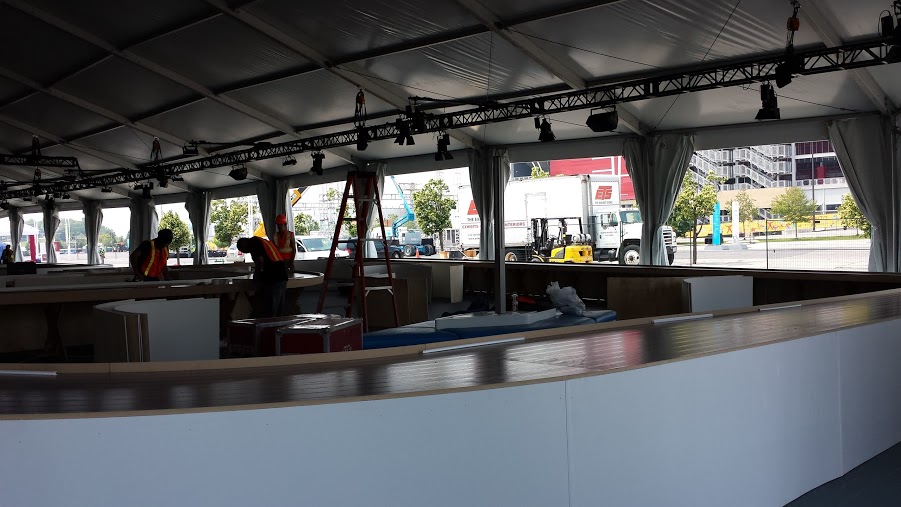
Locate an element on the screen. The width and height of the screenshot is (901, 507). countertop is located at coordinates (168, 405).